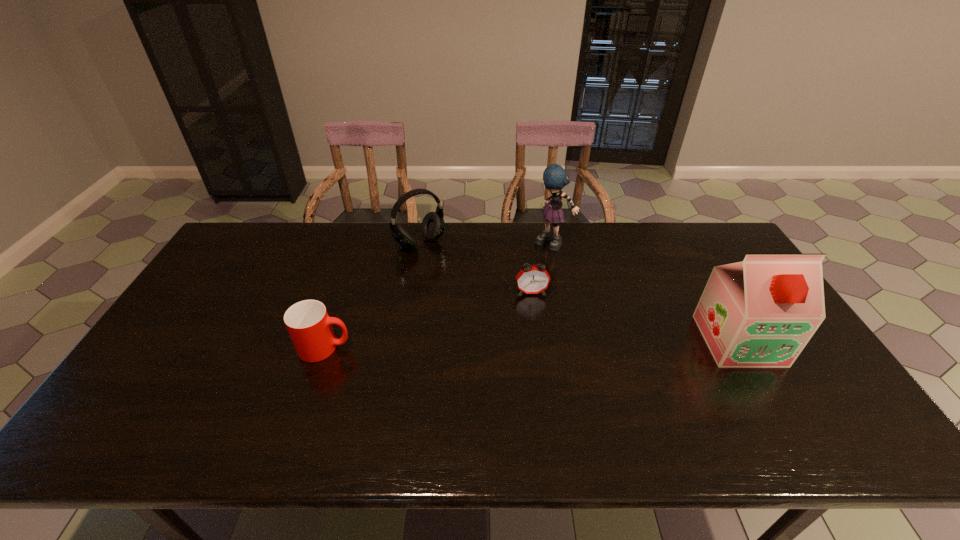
At what (x,y) coordinates should I click in order to perform the action: click on the leftmost object. Please return your answer as a coordinate pair (x, y). Looking at the image, I should click on (308, 323).

Where is `soya milk`? The image size is (960, 540). soya milk is located at coordinates (759, 313).

The height and width of the screenshot is (540, 960). In order to click on the third tallest object in this screenshot , I will do `click(432, 227)`.

This screenshot has height=540, width=960. What are the coordinates of `the fourth object from right to left` in the screenshot? It's located at (432, 227).

Locate an element on the screen. rag doll is located at coordinates (555, 178).

The image size is (960, 540). I want to click on the third nearest object, so click(534, 279).

Identify the location of blank area located 0.140m on the side of the leftmost object with the handle. The height and width of the screenshot is (540, 960). (403, 348).

Locate an element on the screen. free space located 0.130m with the cap open on the rightmost object is located at coordinates (780, 412).

At what (x,y) coordinates should I click in order to perform the action: click on free location located on the ear cups of the third shortest object. Please return your answer as a coordinate pair (x, y). Image resolution: width=960 pixels, height=540 pixels. Looking at the image, I should click on (450, 271).

Locate an element on the screen. This screenshot has height=540, width=960. vacant position located 0.260m on the ear cups of the third shortest object is located at coordinates (476, 297).